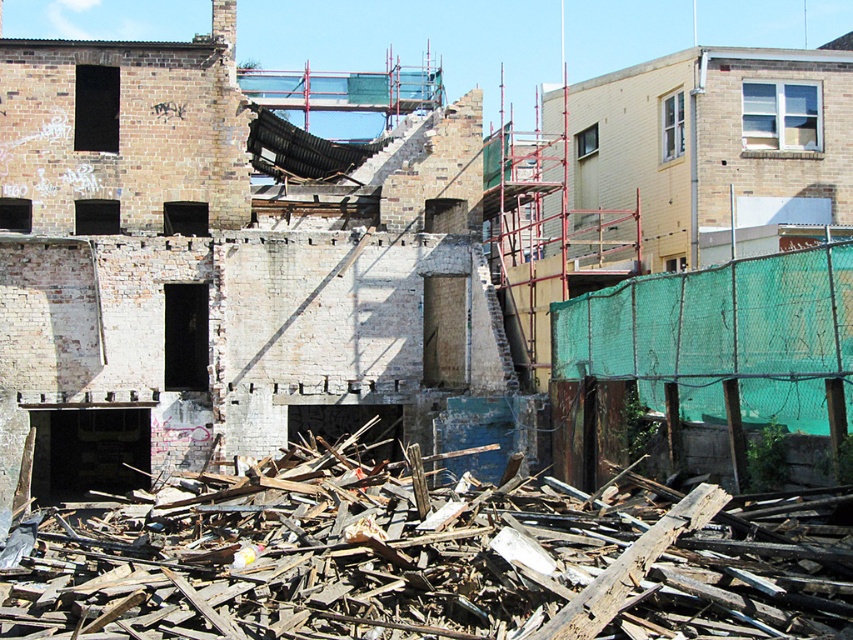
Consider the image. Is brick wall at left smaller than wooden debris at lower center?

Actually, brick wall at left might be larger than wooden debris at lower center.

From the picture: Does brick wall at left have a lesser height compared to wooden debris at lower center?

No, brick wall at left is not shorter than wooden debris at lower center.

Does point (225, 426) lie in front of point (512, 531)?

No.

Locate an element on the screen. brick wall at left is located at coordinates (219, 266).